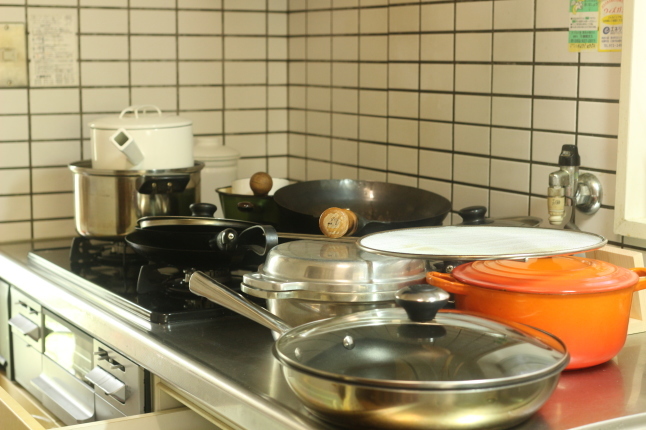
You are a GUI agent. You are given a task and a screenshot of the screen. Output one action in this format:
    pyautogui.click(x=<x>, y=<y>)
    Task: Click on the black pots and pans
    
    Given the screenshot: What is the action you would take?
    pyautogui.click(x=325, y=198), pyautogui.click(x=234, y=200), pyautogui.click(x=178, y=248)